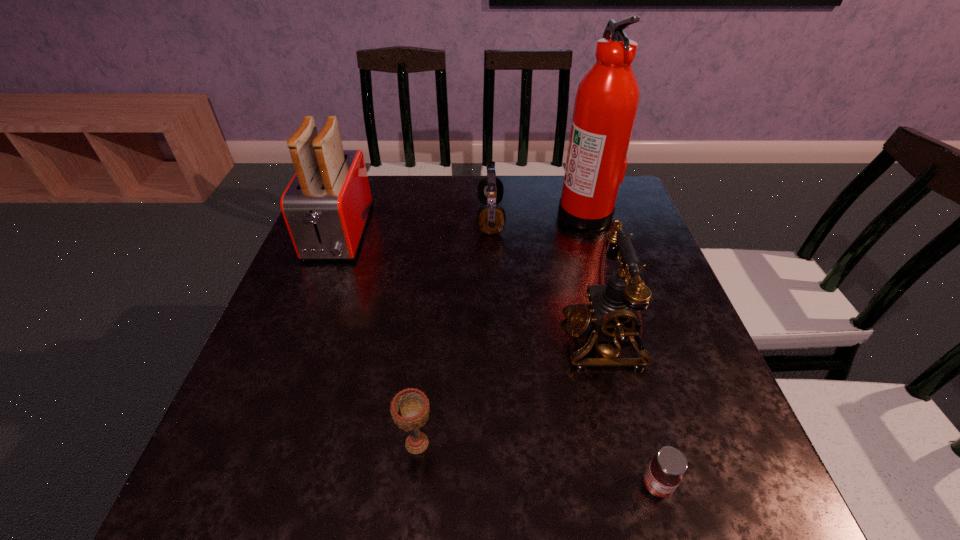
What are the coordinates of `the tallest object` in the screenshot? It's located at (607, 99).

Locate an element on the screen. the fifth shortest object is located at coordinates (326, 205).

This screenshot has height=540, width=960. I want to click on the leftmost object, so click(326, 205).

Locate an element on the screen. The width and height of the screenshot is (960, 540). the fourth shortest object is located at coordinates 612,313.

Image resolution: width=960 pixels, height=540 pixels. Identify the location of telephone. (612, 313).

This screenshot has width=960, height=540. Find the location of `the third shortest object`. the third shortest object is located at coordinates (491, 217).

You are a GUI agent. You are given a task and a screenshot of the screen. Output one action in this format:
    pyautogui.click(x=<x>, y=<y>)
    Task: Click on the headset
    The width and height of the screenshot is (960, 540).
    Given the screenshot: What is the action you would take?
    pyautogui.click(x=491, y=217)

Locate an element on the screen. The image size is (960, 540). the fifth farthest object is located at coordinates (409, 409).

Locate an element on the screen. Image resolution: width=960 pixels, height=540 pixels. chalice is located at coordinates (409, 409).

This screenshot has height=540, width=960. Find the location of `the nearest object`. the nearest object is located at coordinates (663, 475).